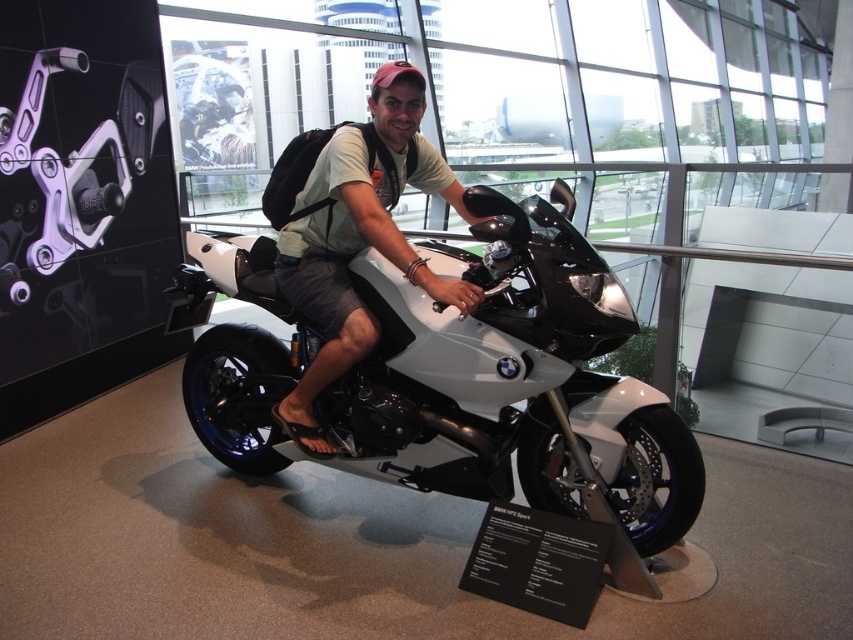
Is white glossy motorcycle at center to the right of matte black motorcycle at center from the viewer's perspective?

Incorrect, white glossy motorcycle at center is not on the right side of matte black motorcycle at center.

What do you see at coordinates (451, 374) in the screenshot? This screenshot has width=853, height=640. I see `white glossy motorcycle at center` at bounding box center [451, 374].

This screenshot has width=853, height=640. I want to click on white glossy motorcycle at center, so click(451, 374).